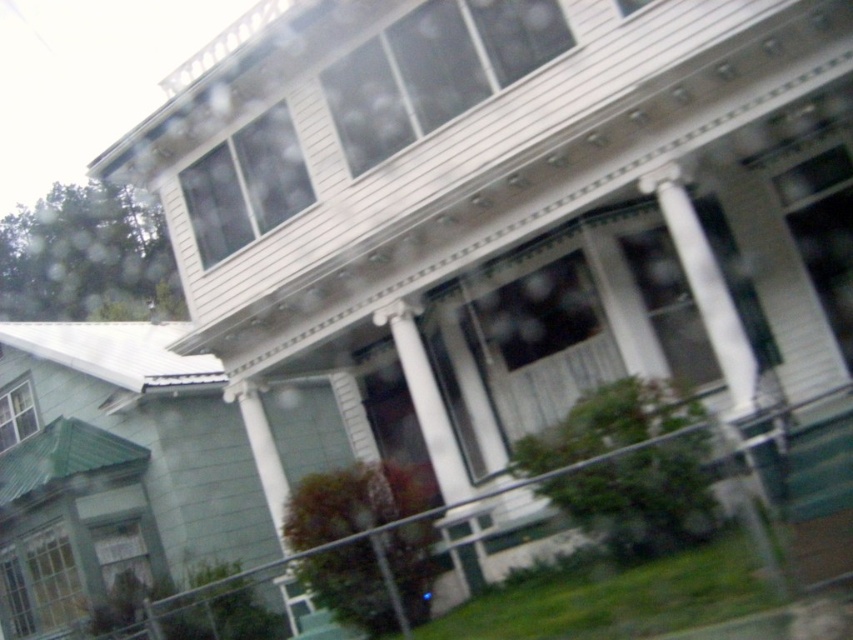
You are standing in front of the house and want to look through the clear glass window at upper left and the white glossy column at center. Which object is closer to your left side?

The clear glass window at upper left is positioned on the left side of white glossy column at center, so it is closer to your left side.

You are standing in front of the house and want to enter through the clear glass window at lower left. To reach it, you need to walk around the white wood porch at center. Which direction should you walk around the porch to get to the window?

Since the white wood porch at center is to the right of the clear glass window at lower left, you should walk around the left side of the white wood porch at center to reach the clear glass window at lower left.

You are a delivery person approaching the house and need to determine if the point marked at coordinates [245,186] is on the clear glass window at upper left. Based on the scene description, can you confirm this?

The point marked at coordinates [245,186] is on the clear glass window at upper left according to the objects description.